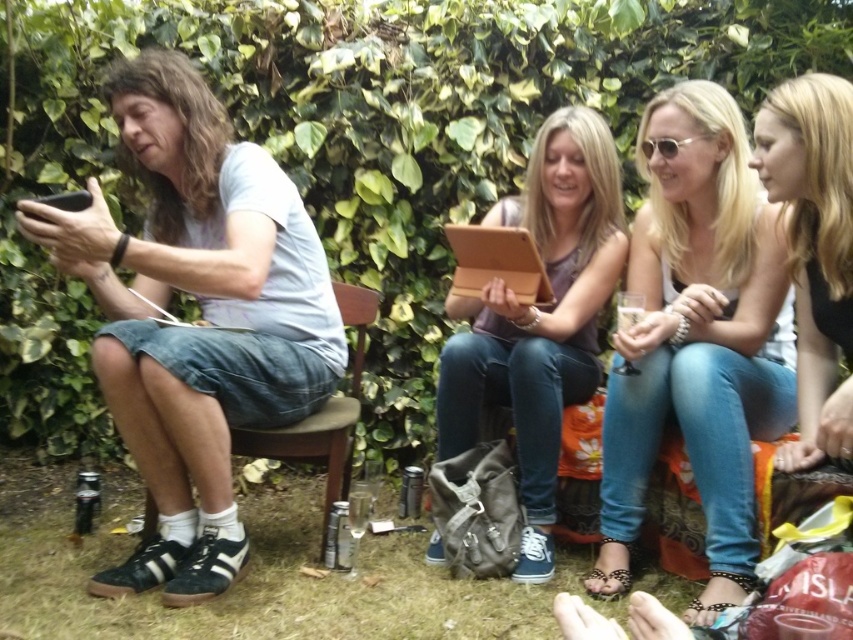
You are standing in the garden and want to hand a matte brown tablet at center to a friend who is 1.5 meters away from you. Can you reach them without moving?

The distance between you and the matte brown tablet at center is 1.94 meters, which is further than the 1.5 meters to your friend. Therefore, you cannot reach them without moving closer.